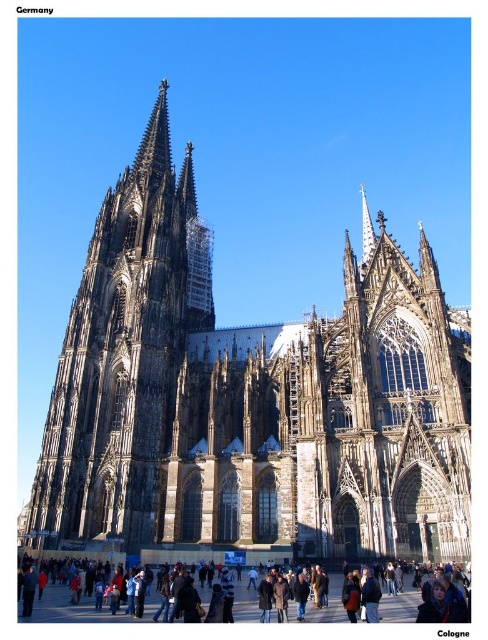
Question: Which point is closer to the camera?

Choices:
 (A) dark gray stone church at center
 (B) dark brown leather jacket at lower center
 (C) dark gray stone tower at left

Answer: (B)

Question: Does dark gray stone church at center appear under dark brown leather jacket at lower center?

Choices:
 (A) yes
 (B) no

Answer: (B)

Question: Estimate the real-world distances between objects in this image. Which object is farther from the dark gray stone church at center?

Choices:
 (A) dark brown leather jacket at lower center
 (B) dark gray stone tower at left

Answer: (A)

Question: Can you confirm if dark gray stone church at center is positioned below dark gray stone tower at left?

Choices:
 (A) no
 (B) yes

Answer: (B)

Question: Is dark gray stone church at center above dark brown leather jacket at lower center?

Choices:
 (A) no
 (B) yes

Answer: (B)

Question: Which point is farther to the camera?

Choices:
 (A) (289, 611)
 (B) (98, 317)

Answer: (B)